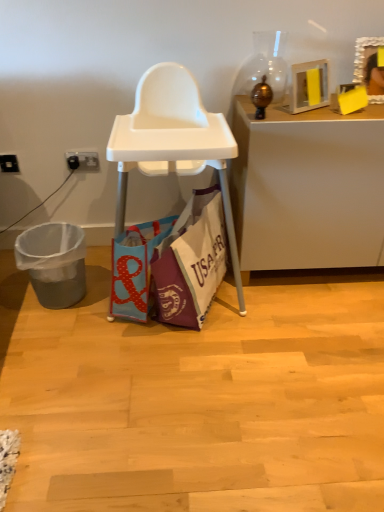
At what (x,y) coordinates should I click in order to perform the action: click on vacant space that's between white plastic high chair at center and purple fabric bag at center, which is the second handbag from left to right. Please return your answer as a coordinate pair (x, y). The width and height of the screenshot is (384, 512). Looking at the image, I should click on (202, 331).